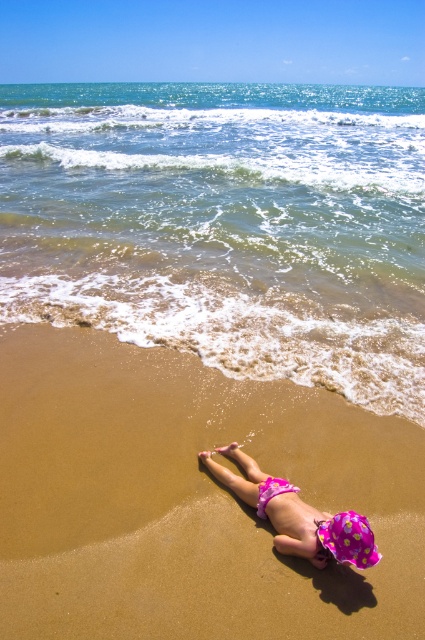
You are a lifeguard observing the beach scene. There is a pink polka dot swim cap at lower center. Where is the pink polka dot swim cap located in relation to the child?

The pink polka dot swim cap at lower center is located at point (297, 515), which is near the child since it is positioned at their lower center.

You are a photographer trying to capture the child in the beach scene. You want to ensure the pink polka dot swim cap at lower center and the pink fabric stomach at lower center are both visible in the shot. Based on their positions, which object will appear larger in the photo?

The pink polka dot swim cap at lower center appears larger in the photo because it is taller than the pink fabric stomach at lower center.

You are a photographer planning to take a photo of the brown sandy beach at lower center and the pink fabric stomach at lower center in the beach scene. Based on their sizes, which object should you focus on to ensure both are clearly visible in the frame?

The brown sandy beach at lower center is larger in size than the pink fabric stomach at lower center, so focusing on the larger brown sandy beach at lower center would ensure both objects are clearly visible in the frame.